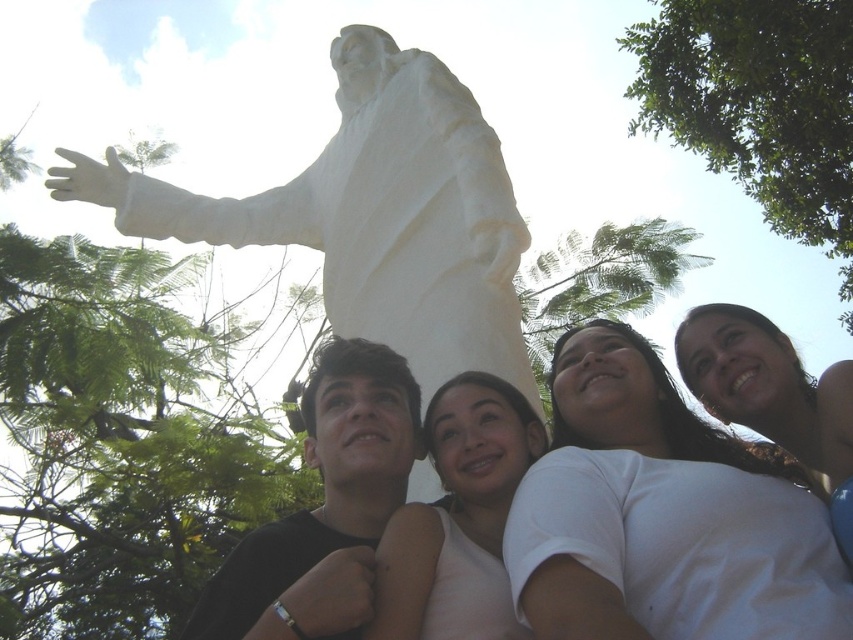
You are standing in a park and see the statue of Jesus Christ. There is a point marked at coordinates (373, 214). What does this point represent?

The point at coordinates (373, 214) corresponds to the white marble statue at upper center.

You are standing in front of the white marble statue at upper center and want to take a photo of it with your camera. Given that the statue is 149.82 feet away from the camera, is it possible to capture the entire statue in one frame without moving closer or further away?

The white marble statue at upper center is 149.82 feet away from the camera. Depending on the camera lens and zoom capabilities, it might be challenging to capture the entire statue in one frame from that distance without adjusting the camera settings or using a wide angle lens.